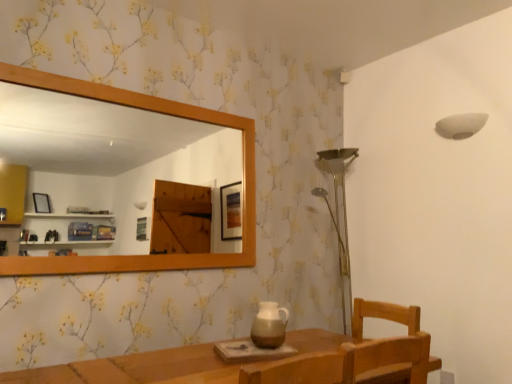
Question: Can you confirm if wooden mirror at upper left is positioned to the left of white matte lampshade at upper right?

Choices:
 (A) no
 (B) yes

Answer: (B)

Question: Considering the relative sizes of wooden mirror at upper left and white matte lampshade at upper right in the image provided, is wooden mirror at upper left thinner than white matte lampshade at upper right?

Choices:
 (A) no
 (B) yes

Answer: (B)

Question: Can you confirm if wooden mirror at upper left is bigger than white matte lampshade at upper right?

Choices:
 (A) no
 (B) yes

Answer: (B)

Question: Is wooden mirror at upper left in contact with white matte lampshade at upper right?

Choices:
 (A) yes
 (B) no

Answer: (B)

Question: Would you say wooden mirror at upper left is a long distance from white matte lampshade at upper right?

Choices:
 (A) no
 (B) yes

Answer: (B)

Question: From a real-world perspective, is white matte lampshade at upper right positioned above or below brown ceramic pitcher at center?

Choices:
 (A) above
 (B) below

Answer: (A)

Question: From the image's perspective, is white matte lampshade at upper right positioned above or below brown ceramic pitcher at center?

Choices:
 (A) above
 (B) below

Answer: (A)

Question: Is white matte lampshade at upper right to the left or to the right of brown ceramic pitcher at center in the image?

Choices:
 (A) right
 (B) left

Answer: (A)

Question: Is white matte lampshade at upper right taller or shorter than brown ceramic pitcher at center?

Choices:
 (A) short
 (B) tall

Answer: (A)

Question: Considering the positions of brown ceramic pitcher at center and white matte lampshade at upper right in the image, is brown ceramic pitcher at center taller or shorter than white matte lampshade at upper right?

Choices:
 (A) tall
 (B) short

Answer: (A)

Question: Does point (267, 304) appear closer or farther from the camera than point (443, 130)?

Choices:
 (A) farther
 (B) closer

Answer: (B)

Question: Based on their sizes in the image, would you say brown ceramic pitcher at center is bigger or smaller than white matte lampshade at upper right?

Choices:
 (A) big
 (B) small

Answer: (B)

Question: Is brown ceramic pitcher at center inside the boundaries of white matte lampshade at upper right, or outside?

Choices:
 (A) outside
 (B) inside

Answer: (A)

Question: Is wooden mirror at upper left inside the boundaries of white matte lampshade at upper right, or outside?

Choices:
 (A) outside
 (B) inside

Answer: (A)

Question: Is wooden mirror at upper left in front of or behind white matte lampshade at upper right in the image?

Choices:
 (A) front
 (B) behind

Answer: (A)